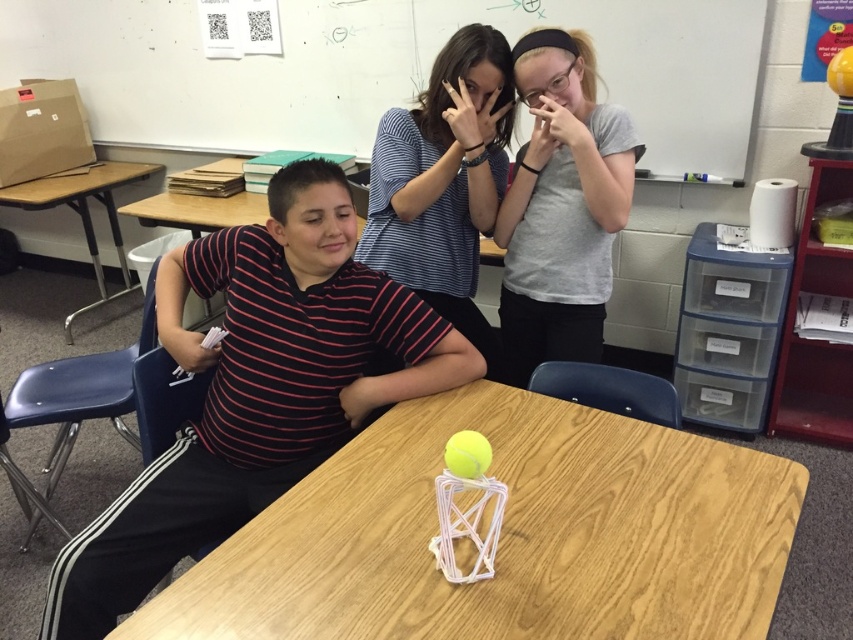
You are a student sitting at the back of the classroom. You notice a point at coordinates (x=258, y=388) on the table. Which object from the scene is located exactly at that point?

The striped cotton shirt at left is located exactly at point (x=258, y=388).